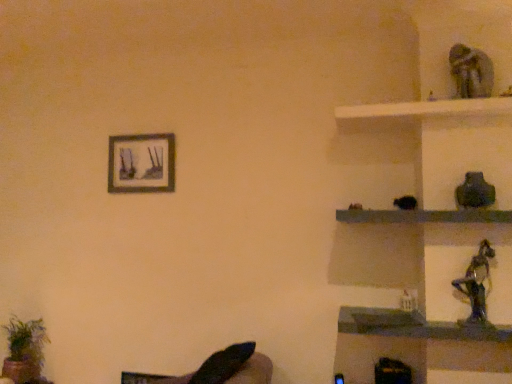
Question: Is black leather swivel chair at lower left to the left or to the right of green leafy plant at lower left in the image?

Choices:
 (A) right
 (B) left

Answer: (A)

Question: Is black leather swivel chair at lower left in front of or behind green leafy plant at lower left in the image?

Choices:
 (A) front
 (B) behind

Answer: (A)

Question: Which object is the farthest from the matte black picture frame at upper left?

Choices:
 (A) green leafy plant at lower left
 (B) shiny metallic figurine at right
 (C) black glossy statue at upper right, the 1th shelf in the top-to-bottom sequence
 (D) black glossy statue at lower right, placed as the first shelf when sorted from bottom to top
 (E) black leather swivel chair at lower left

Answer: (B)

Question: Estimate the real-world distances between objects in this image. Which object is closer to the black leather swivel chair at lower left?

Choices:
 (A) matte black picture frame at upper left
 (B) black glossy statue at lower right, the 2th shelf from the top
 (C) shiny metallic figurine at right
 (D) green leafy plant at lower left
 (E) black glossy statue at upper right, the 1th shelf in the top-to-bottom sequence

Answer: (B)